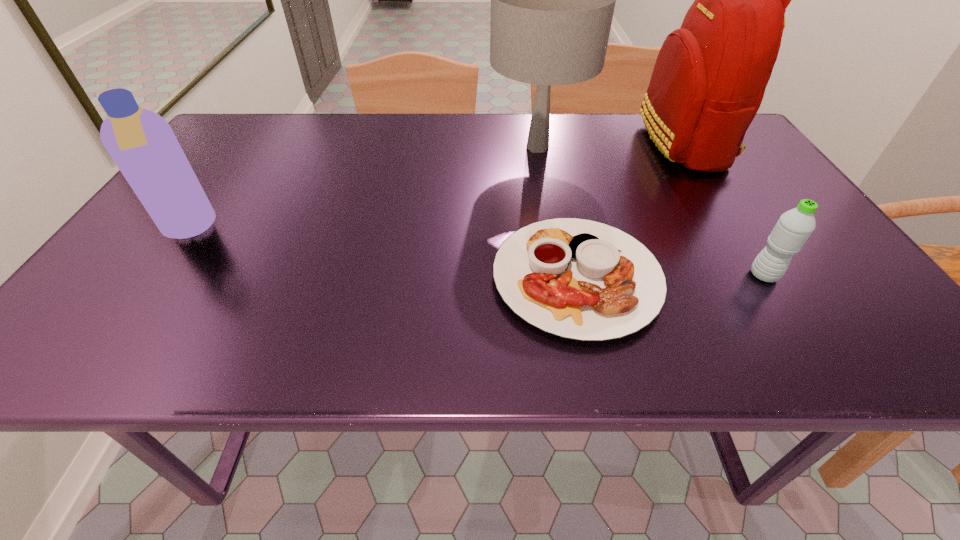
You are a GUI agent. You are given a task and a screenshot of the screen. Output one action in this format:
    pyautogui.click(x=<x>, y=<y>)
    Task: Click on the free space that satisfies the following two spatial constraints: 1. on the front-facing side of the backpack; 2. on the front side of the platter
    
    Given the screenshot: What is the action you would take?
    pyautogui.click(x=769, y=278)